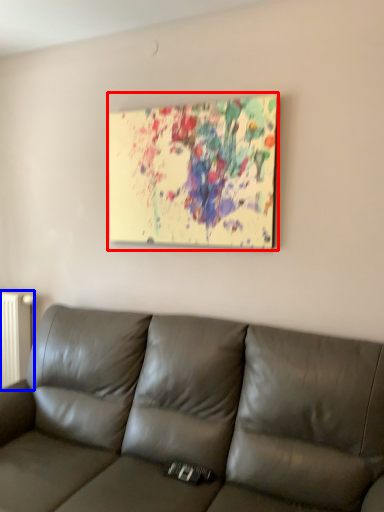
Question: Which of the following is the closest to the observer, picture frame (highlighted by a red box) or radiator (highlighted by a blue box)?

Choices:
 (A) picture frame
 (B) radiator

Answer: (A)